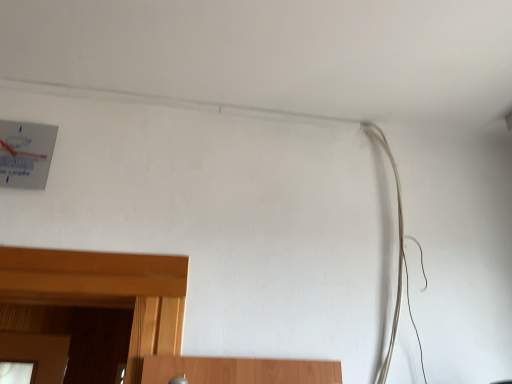
Measure the distance between white matte cable at right and camera.

The distance of white matte cable at right from camera is 3.69 feet.

The width and height of the screenshot is (512, 384). What do you see at coordinates (398, 261) in the screenshot?
I see `white matte cable at right` at bounding box center [398, 261].

In order to click on white matte cable at right in this screenshot , I will do `click(398, 261)`.

What is the approximate height of white matte cable at right?

white matte cable at right is 32.32 inches in height.

This screenshot has height=384, width=512. What are the coordinates of `white matte cable at right` in the screenshot? It's located at (398, 261).